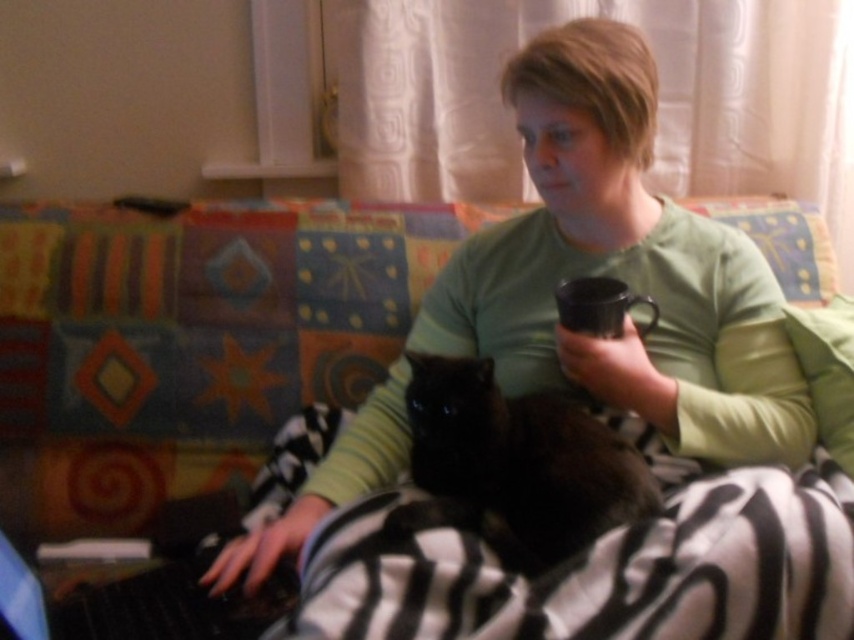
Question: Where is green soft shirt at center located in relation to black fur cat at center in the image?

Choices:
 (A) below
 (B) above

Answer: (B)

Question: Which point is closer to the camera?

Choices:
 (A) (562, 428)
 (B) (794, 456)

Answer: (A)

Question: Can you confirm if green soft shirt at center is positioned above black fur cat at center?

Choices:
 (A) yes
 (B) no

Answer: (A)

Question: Can you confirm if green soft shirt at center is positioned above black fur cat at center?

Choices:
 (A) yes
 (B) no

Answer: (A)